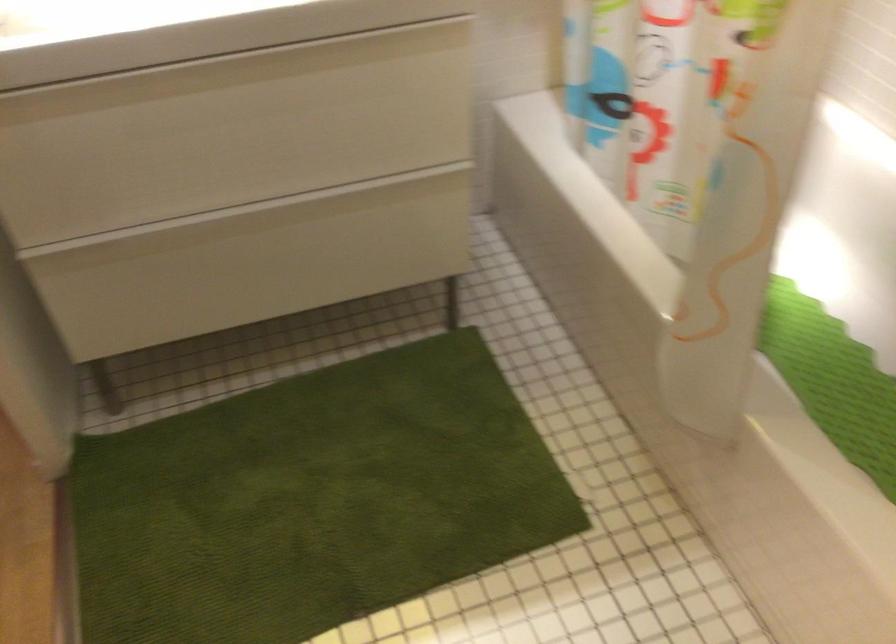
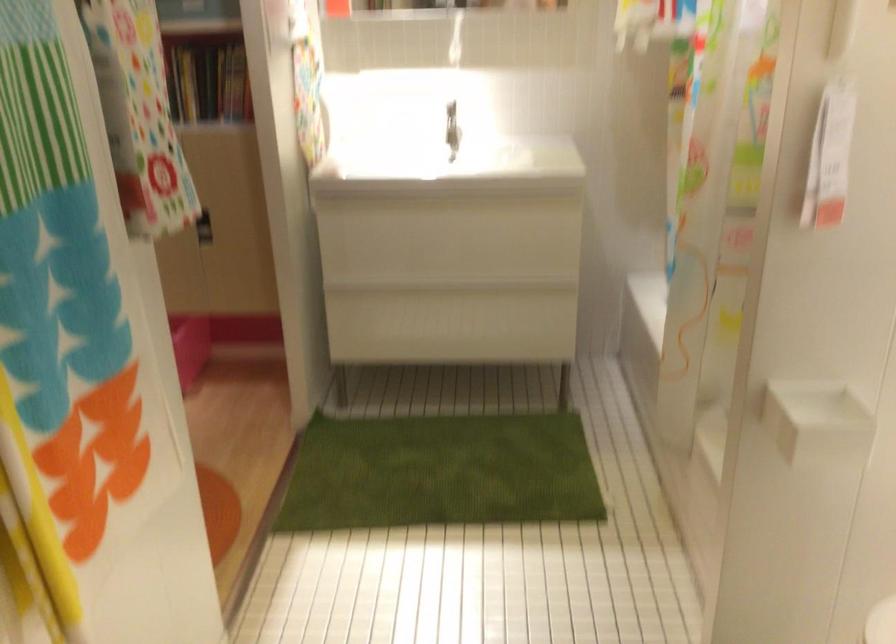
Question: I am providing you with two images of the same scene from different viewpoints. Please identify which objects are invisible in image2.

Choices:
 (A) gold doorknob
 (B) small white container
 (C) green bath rug
 (D) faucet handle

Answer: (C)